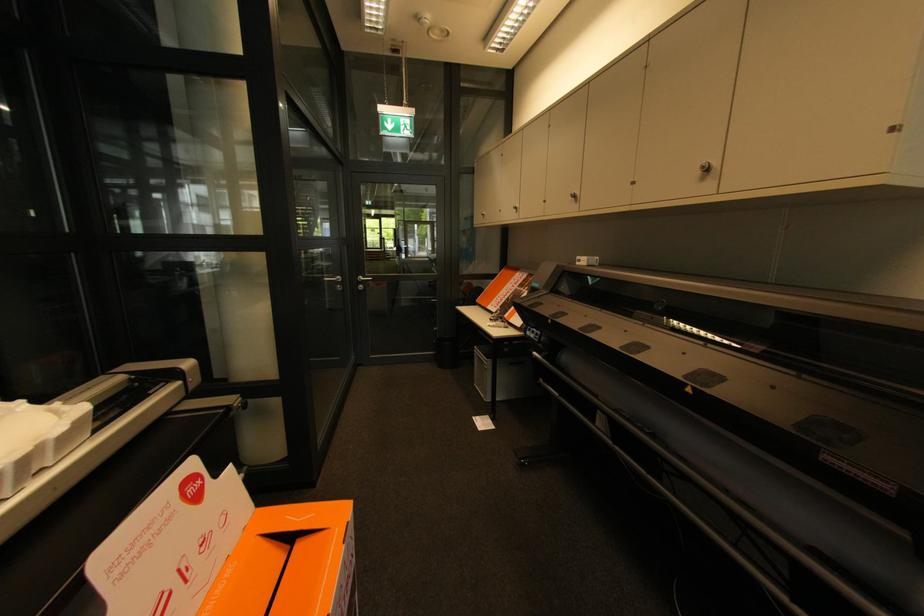
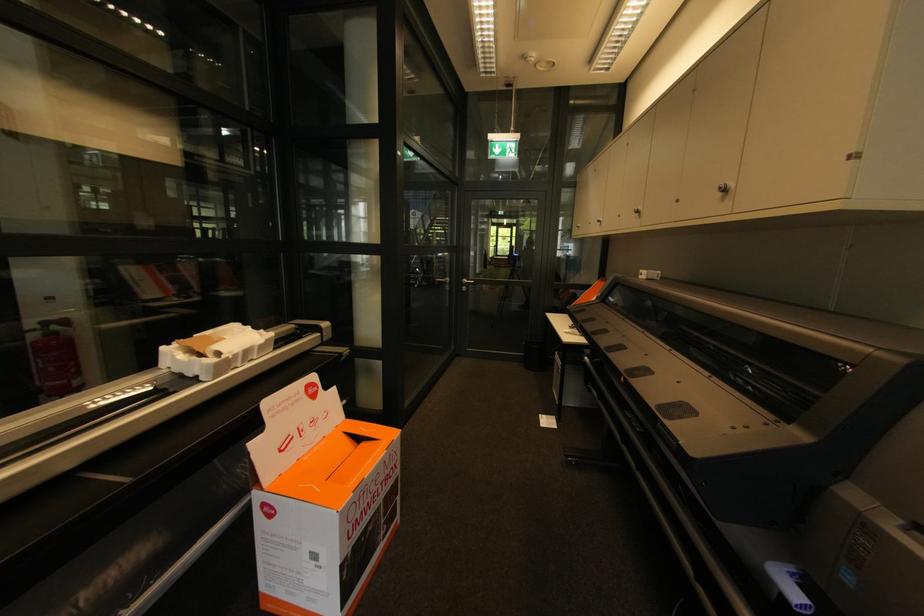
In the second image, find the point that corresponds to point 711,169 in the first image.

(727, 191)